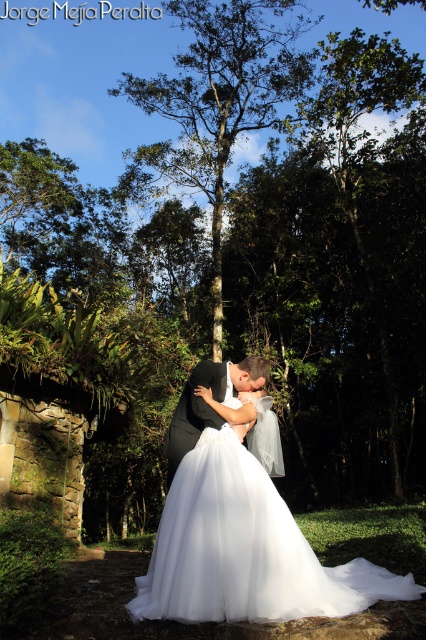
Based on the photo, which is more to the left, white tulle dress at center or green leafy tree at center?

green leafy tree at center

Describe the element at coordinates (244, 548) in the screenshot. I see `white tulle dress at center` at that location.

This screenshot has width=426, height=640. I want to click on white tulle dress at center, so click(244, 548).

What are the coordinates of `white tulle dress at center` in the screenshot? It's located at (244, 548).

Between white tulle dress at center and black satin suit at center, which one is positioned higher?

Positioned higher is black satin suit at center.

Can you confirm if white tulle dress at center is wider than black satin suit at center?

Yes, white tulle dress at center is wider than black satin suit at center.

Measure the distance between white tulle dress at center and camera.

The distance of white tulle dress at center from camera is 3.29 meters.

I want to click on white tulle dress at center, so click(244, 548).

Can you confirm if green leafy tree at center is bigger than black satin suit at center?

Yes, green leafy tree at center is bigger than black satin suit at center.

Can you confirm if green leafy tree at center is positioned below black satin suit at center?

No.

Who is more distant from viewer, (219, 202) or (169, 461)?

The point (219, 202) is more distant.

The width and height of the screenshot is (426, 640). What are the coordinates of `green leafy tree at center` in the screenshot? It's located at (222, 97).